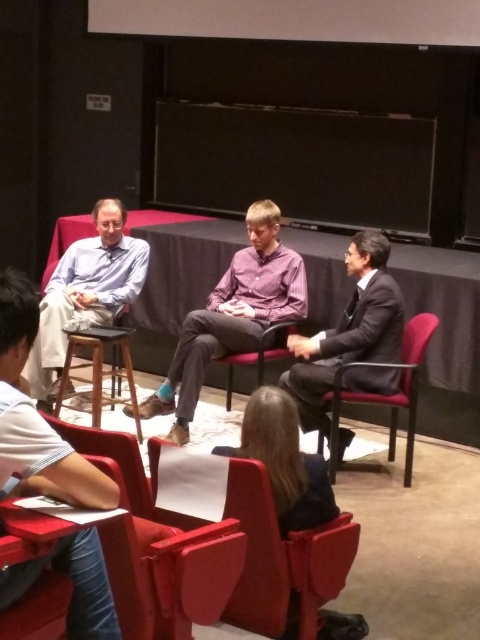
You are standing at the entrance of the conference room and want to locate the matte blue shirt at center. According to the coordinates provided, where should you look to find it?

The matte blue shirt at center is located at coordinates point [232,316], which is near the center of the image.

You are standing at the entrance of the conference room and see the point marked as point (280, 557). What object does this point correspond to?

The point (280, 557) corresponds to the smooth leather chair at lower center.